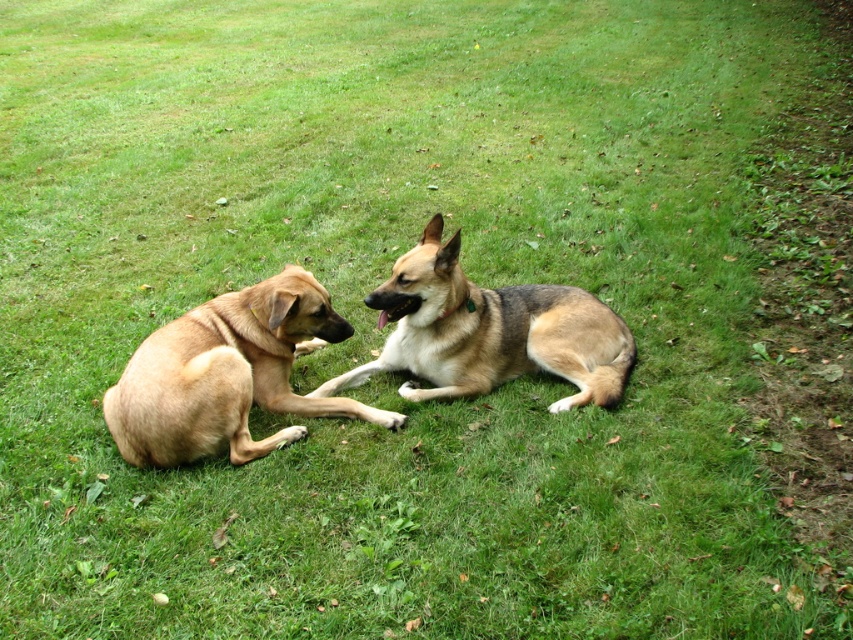
Question: Is golden fur dog at left positioned at the back of brown fur dog at center?

Choices:
 (A) no
 (B) yes

Answer: (A)

Question: Which point is farther from the camera taking this photo?

Choices:
 (A) (547, 365)
 (B) (161, 412)

Answer: (A)

Question: Does golden fur dog at left lie behind brown fur dog at center?

Choices:
 (A) no
 (B) yes

Answer: (A)

Question: Observing the image, what is the correct spatial positioning of golden fur dog at left in reference to brown fur dog at center?

Choices:
 (A) left
 (B) right

Answer: (A)